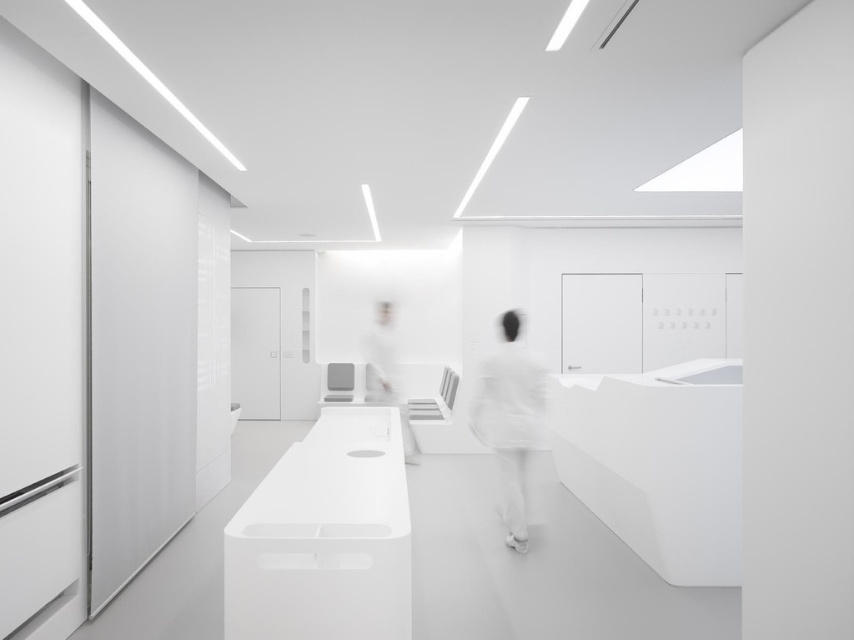
You are a healthcare worker needing to quickly access the white matte uniform at center while standing next to the white glossy person at center. Can you reach it without moving more than 6 feet away from your current position?

The distance between the white matte uniform at center and the white glossy person at center is 8.00 feet, so you would need to move 8.00 feet to reach it. Since the maximum allowed distance is 6 feet, you cannot reach it without exceeding the limit.

You are a healthcare worker entering the room and need to identify which item is narrower between the white matte uniform at center and the white glossy person at center. Which one should you choose?

The white matte uniform at center is thinner than the white glossy person at center, so you should choose the white matte uniform at center as the narrower item.

You are a healthcare worker entering the room and need to locate the white matte uniform at center. Based on the coordinates provided, where should you look to find it?

Result: The white matte uniform at center is located at coordinates point (x=510, y=419), which is in the central area of the room.